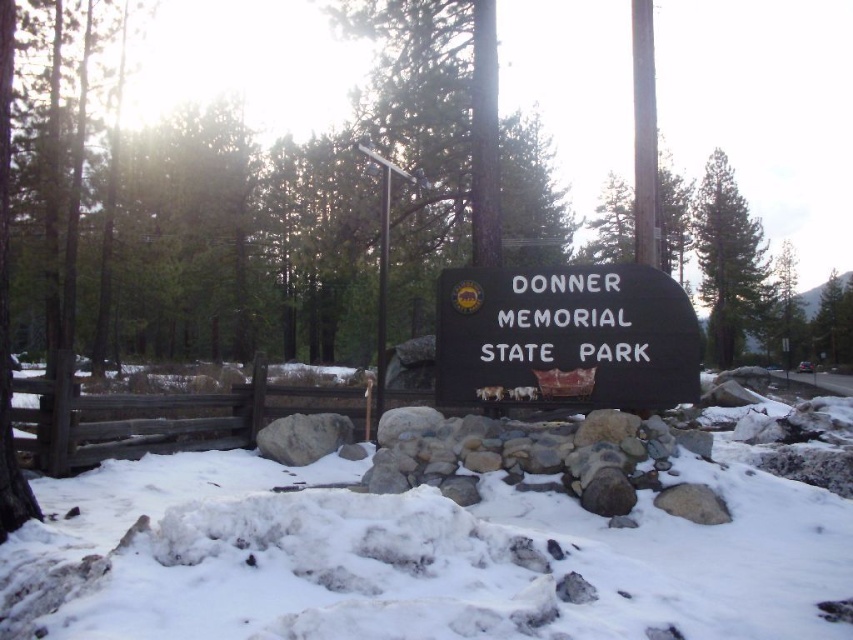
Question: Estimate the real-world distances between objects in this image. Which object is farther from the green textured pine tree at upper right?

Choices:
 (A) black stone sign at center
 (B) white fluffy snow at center
 (C) green leafy tree at upper right

Answer: (B)

Question: Which object is closer to the camera taking this photo?

Choices:
 (A) green textured pine tree at upper right
 (B) gray rock at center

Answer: (B)

Question: Does black stone sign at center have a lesser width compared to green leafy tree at upper right?

Choices:
 (A) no
 (B) yes

Answer: (B)

Question: Which point appears farthest from the camera in this image?

Choices:
 (A) (711, 195)
 (B) (456, 284)

Answer: (A)

Question: Is white fluffy snow at center above gray rock at center?

Choices:
 (A) no
 (B) yes

Answer: (B)

Question: Is black stone sign at center smaller than green leafy tree at upper right?

Choices:
 (A) no
 (B) yes

Answer: (B)